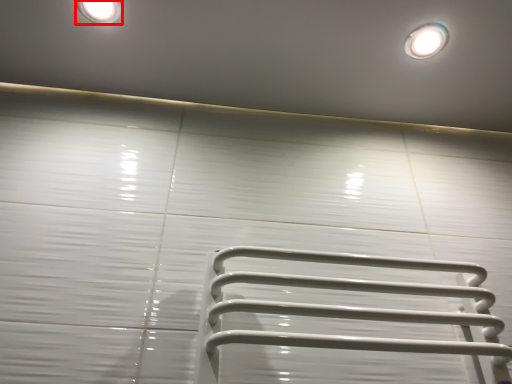
Question: From the image's perspective, considering the relative positions of lighting (annotated by the red box) and droplight in the image provided, where is lighting (annotated by the red box) located with respect to the staircase?

Choices:
 (A) above
 (B) below

Answer: (A)